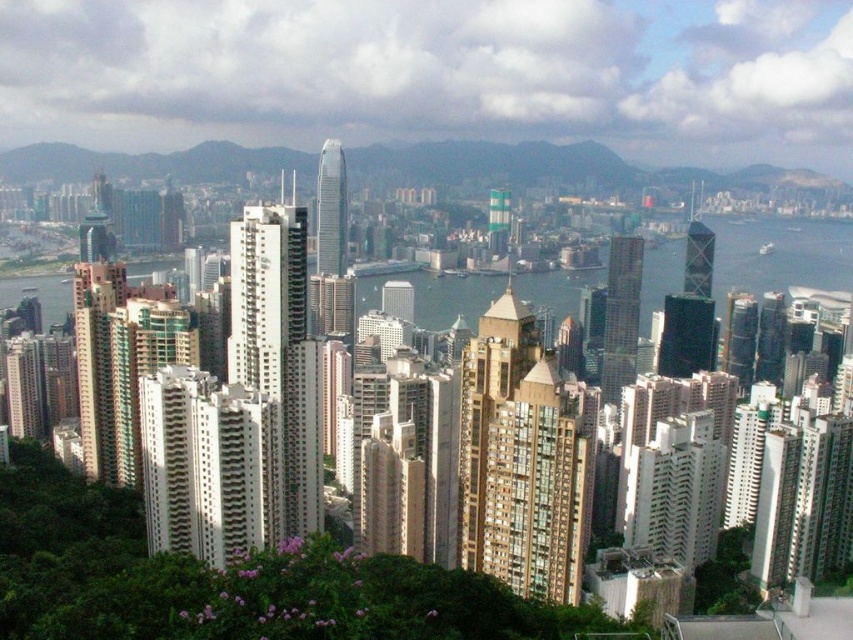
From the picture: Based on the provided scene description, what object is located at the coordinates point (x=779, y=256)?

The transparent glass water at center is located at point (x=779, y=256).

You are a city planner analyzing the skyline of this urban area. You need to determine which of the two structures, the gold glassy building at center or the transparent glass water at center, has a narrower width in the image. Which one is narrower?

The gold glassy building at center is thinner than transparent glass water at center, so the gold glassy building at center is narrower in width.